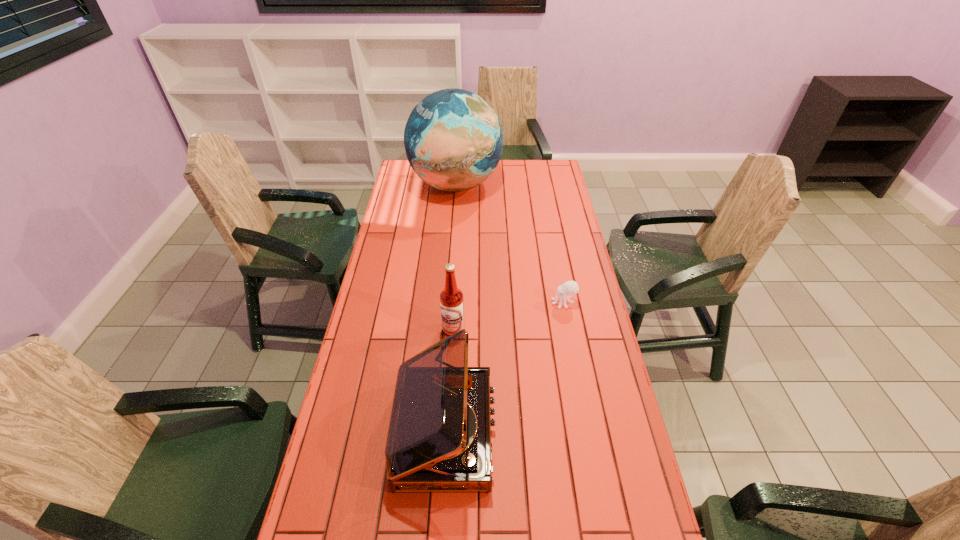
What are the coordinates of `vacant space situated 0.320m on the front-facing side of the rightmost object` in the screenshot? It's located at (462, 302).

This screenshot has height=540, width=960. Identify the location of vacant region located on the front-facing side of the rightmost object. (532, 302).

Locate an element on the screen. The width and height of the screenshot is (960, 540). object that is at the far edge is located at coordinates coord(453,139).

Find the location of a particular element. This screenshot has height=540, width=960. object situated at the left edge is located at coordinates (453, 139).

This screenshot has width=960, height=540. I want to click on object situated at the right edge, so click(x=569, y=288).

This screenshot has height=540, width=960. In order to click on object present at the far left corner in this screenshot , I will do `click(453, 139)`.

Where is `vacant space at the left edge of the desktop`? This screenshot has height=540, width=960. vacant space at the left edge of the desktop is located at coordinates (394, 235).

The width and height of the screenshot is (960, 540). Identify the location of free space at the right edge of the desktop. (543, 261).

Where is `empty space that is in between the globe and the alcohol`? empty space that is in between the globe and the alcohol is located at coordinates (455, 257).

Identify the location of empty space between the third nearest object and the farthest object. (510, 244).